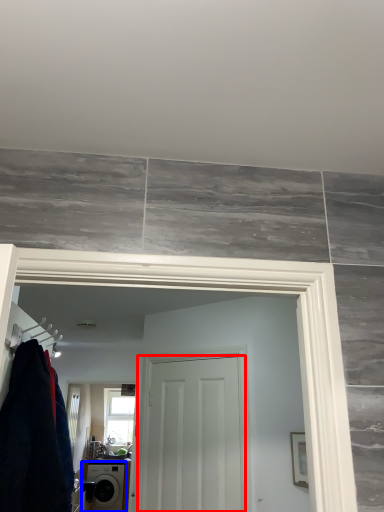
Question: Among these objects, which one is farthest to the camera, door (highlighted by a red box) or washing machine (highlighted by a blue box)?

Choices:
 (A) door
 (B) washing machine

Answer: (B)